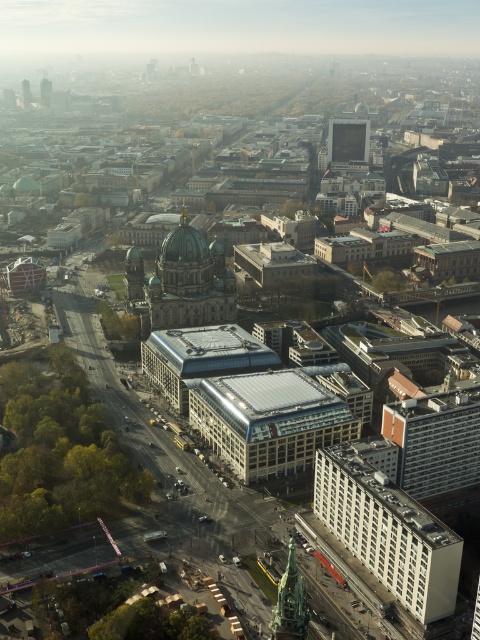
You are a drone operator flying a drone over the city. You need to capture a photo of the bronze statue at lower center without the orange brick building at lower right blocking the view. Is this possible based on their positions?

The orange brick building at lower right is further to the viewer than the bronze statue at lower center. Therefore, if the drone is positioned appropriately, it can capture the bronze statue at lower center without obstruction from the orange brick building at lower right.

You are a city planner reviewing the aerial view of the city. You need to determine which building is taller between the glassy reflective building at center and the orange brick building at lower right. Which one is taller?

The orange brick building at lower right is taller than the glassy reflective building at center.